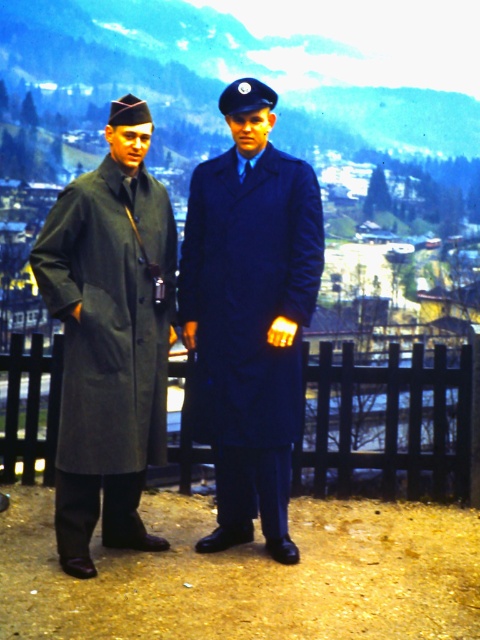
Please describe the exact 2D coordinates of the matte blue coat at center in the image.

The matte blue coat at center is located at the 2D coordinates of point (250, 314).

You are taking a photo of two points in the image. The first point is labeled as point (x=288, y=460) and the second is point (x=469, y=419). Which point will appear larger in your photo?

Point (x=288, y=460) is closer to the camera than point (x=469, y=419), so it will appear larger in the photo.